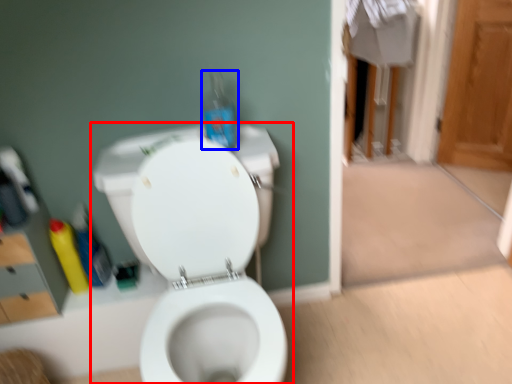
Question: Among these objects, which one is nearest to the camera, toilet (highlighted by a red box) or bottle (highlighted by a blue box)?

Choices:
 (A) toilet
 (B) bottle

Answer: (A)